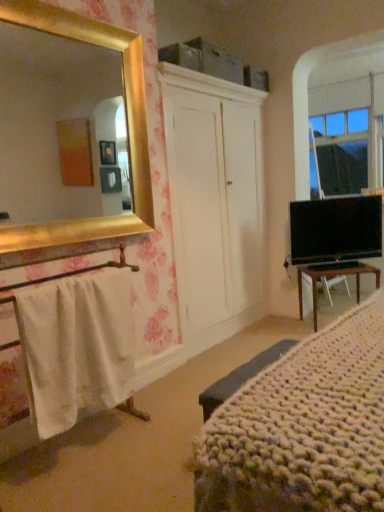
The width and height of the screenshot is (384, 512). Describe the element at coordinates (303, 426) in the screenshot. I see `knitted fabric bed at lower right` at that location.

This screenshot has height=512, width=384. Find the location of `black glossy tv at right`. black glossy tv at right is located at coordinates (335, 229).

Where is `white cotton towel at left`? white cotton towel at left is located at coordinates (77, 347).

Considering the sizes of knitted fabric bed at lower right and white cotton towel at left in the image, is knitted fabric bed at lower right wider or thinner than white cotton towel at left?

Clearly, knitted fabric bed at lower right has more width compared to white cotton towel at left.

Considering the positions of objects knitted fabric bed at lower right and white cotton towel at left in the image provided, who is more to the left, knitted fabric bed at lower right or white cotton towel at left?

white cotton towel at left is more to the left.

Is knitted fabric bed at lower right further to the viewer compared to white cotton towel at left?

That is False.

Does knitted fabric bed at lower right turn towards white cotton towel at left?

Yes, knitted fabric bed at lower right is turned towards white cotton towel at left.

Visually, is black glossy tv at right positioned to the left or to the right of brown wooden desk at lower right?

black glossy tv at right is positioned on brown wooden desk at lower right's left side.

Locate an element on the screen. This screenshot has width=384, height=512. television above the brown wooden desk at lower right (from the image's perspective) is located at coordinates (335, 229).

Considering the sizes of objects black glossy tv at right and brown wooden desk at lower right in the image provided, who is taller, black glossy tv at right or brown wooden desk at lower right?

black glossy tv at right is taller.

Looking at this image, is black glossy tv at right positioned beyond the bounds of brown wooden desk at lower right?

Yes.

From a real-world perspective, between black glossy tv at right and knitted fabric bed at lower right, who is vertically higher?

black glossy tv at right is physically above.

How distant is black glossy tv at right from knitted fabric bed at lower right?

black glossy tv at right is 5.96 feet from knitted fabric bed at lower right.

Is black glossy tv at right oriented towards knitted fabric bed at lower right?

Yes, black glossy tv at right is facing knitted fabric bed at lower right.

Which is behind, point (122, 310) or point (304, 272)?

The point (304, 272) is farther from the camera.

Which of these two, white cotton towel at left or brown wooden desk at lower right, is thinner?

white cotton towel at left.

Would you say white cotton towel at left is to the left or to the right of brown wooden desk at lower right in the picture?

Clearly, white cotton towel at left is on the left of brown wooden desk at lower right in the image.

Looking at the image, does white cotton towel at left seem bigger or smaller compared to brown wooden desk at lower right?

Clearly, white cotton towel at left is smaller in size than brown wooden desk at lower right.

Considering the points (363, 269) and (309, 424), which point is behind, point (363, 269) or point (309, 424)?

The point (363, 269) is farther from the camera.

From the picture: Who is more distant, brown wooden desk at lower right or knitted fabric bed at lower right?

brown wooden desk at lower right is more distant.

Can you confirm if brown wooden desk at lower right is positioned to the right of knitted fabric bed at lower right?

Correct, you'll find brown wooden desk at lower right to the right of knitted fabric bed at lower right.

Image resolution: width=384 pixels, height=512 pixels. In order to click on towel/napkin on the left of brown wooden desk at lower right in this screenshot , I will do `click(77, 347)`.

Does brown wooden desk at lower right have a lesser width compared to white cotton towel at left?

No, brown wooden desk at lower right is not thinner than white cotton towel at left.

Which of these two, brown wooden desk at lower right or white cotton towel at left, stands shorter?

With less height is brown wooden desk at lower right.

Which is in front, white cotton towel at left or black glossy tv at right?

white cotton towel at left is more forward.

Looking at their sizes, would you say white cotton towel at left is wider or thinner than black glossy tv at right?

In the image, white cotton towel at left appears to be more narrow than black glossy tv at right.

Does white cotton towel at left have a greater height compared to black glossy tv at right?

Yes.

Is black glossy tv at right a part of white cotton towel at left?

No.

Find the location of a particular element. The image size is (384, 512). towel/napkin below the knitted fabric bed at lower right (from a real-world perspective) is located at coordinates (77, 347).

At what (x,y) coordinates should I click in order to perform the action: click on desk behind the black glossy tv at right. Please return your answer as a coordinate pair (x, y). Looking at the image, I should click on (332, 278).

Based on their spatial positions, is black glossy tv at right or white cotton towel at left further from knitted fabric bed at lower right?

black glossy tv at right is positioned further to the anchor knitted fabric bed at lower right.

Based on the photo, which object lies nearer to the anchor point brown wooden desk at lower right, black glossy tv at right or knitted fabric bed at lower right?

black glossy tv at right lies closer to brown wooden desk at lower right than the other object.

Looking at the image, which one is located further to knitted fabric bed at lower right, brown wooden desk at lower right or black glossy tv at right?

Among the two, black glossy tv at right is located further to knitted fabric bed at lower right.

When comparing their distances from brown wooden desk at lower right, does knitted fabric bed at lower right or white cotton towel at left seem further?

white cotton towel at left.

Looking at the image, which one is located closer to white cotton towel at left, knitted fabric bed at lower right or brown wooden desk at lower right?

Based on the image, knitted fabric bed at lower right appears to be nearer to white cotton towel at left.

From the image, which object appears to be nearer to brown wooden desk at lower right, black glossy tv at right or white cotton towel at left?

Based on the image, black glossy tv at right appears to be nearer to brown wooden desk at lower right.

From the image, which object appears to be farther from brown wooden desk at lower right, knitted fabric bed at lower right or black glossy tv at right?

knitted fabric bed at lower right is positioned further to the anchor brown wooden desk at lower right.

Which object lies nearer to the anchor point black glossy tv at right, knitted fabric bed at lower right or white cotton towel at left?

knitted fabric bed at lower right is positioned closer to the anchor black glossy tv at right.

Locate an element on the screen. The image size is (384, 512). towel/napkin between knitted fabric bed at lower right and black glossy tv at right from front to back is located at coordinates (77, 347).

Identify the location of television located between knitted fabric bed at lower right and brown wooden desk at lower right in the depth direction. (335, 229).

At what (x,y) coordinates should I click in order to perform the action: click on television between white cotton towel at left and brown wooden desk at lower right from front to back. Please return your answer as a coordinate pair (x, y). Looking at the image, I should click on (335, 229).

The width and height of the screenshot is (384, 512). What are the coordinates of `towel/napkin between knitted fabric bed at lower right and brown wooden desk at lower right along the z-axis` in the screenshot? It's located at (77, 347).